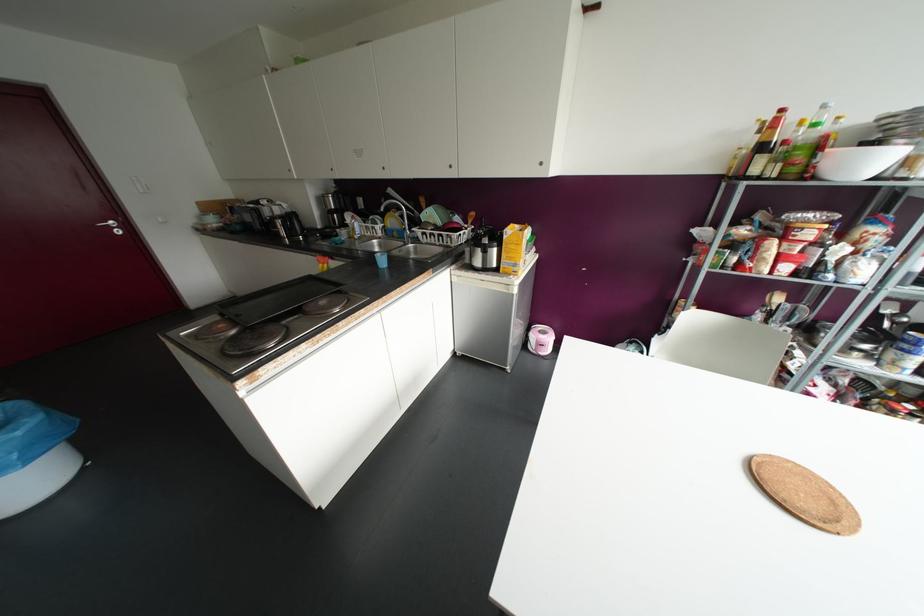
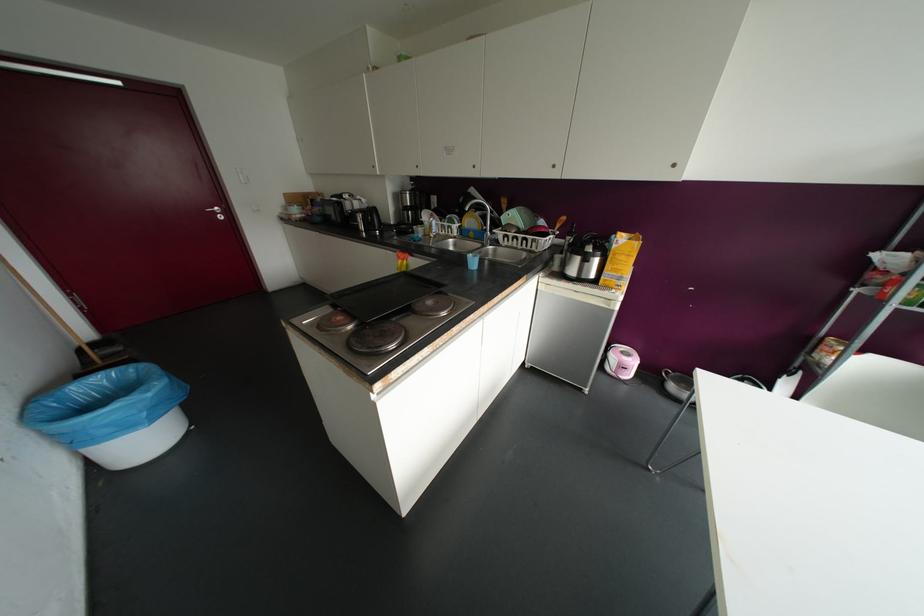
Question: The camera is either moving clockwise (left) or counter-clockwise (right) around the object. The first image is from the beginning of the video and the second image is from the end. Is the camera moving left or right when shooting the video?

Choices:
 (A) Left
 (B) Right

Answer: (B)